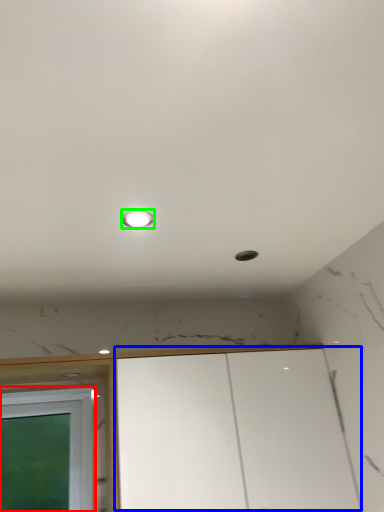
Question: Estimate the real-world distances between objects in this image. Which object is farther from window (highlighted by a red box), cabinetry (highlighted by a blue box) or light (highlighted by a green box)?

Choices:
 (A) cabinetry
 (B) light

Answer: (B)